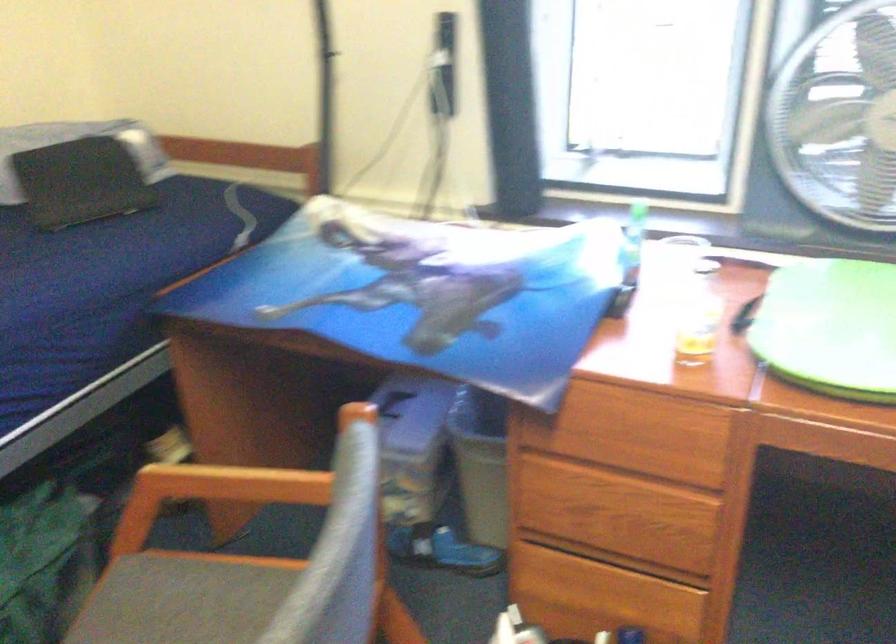
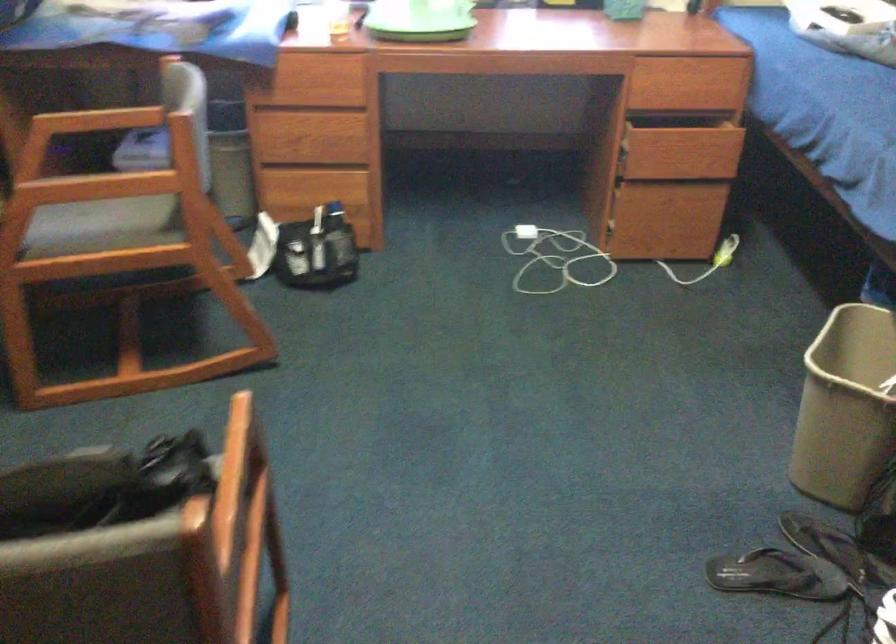
What movement of the cameraman would produce the second image?

The cameraman walked toward left, backward.